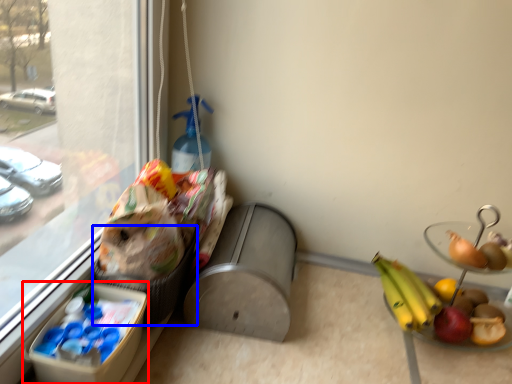
Question: Which object appears closest to the camera in this image, lunch box (highlighted by a red box) or basket (highlighted by a blue box)?

Choices:
 (A) lunch box
 (B) basket

Answer: (A)